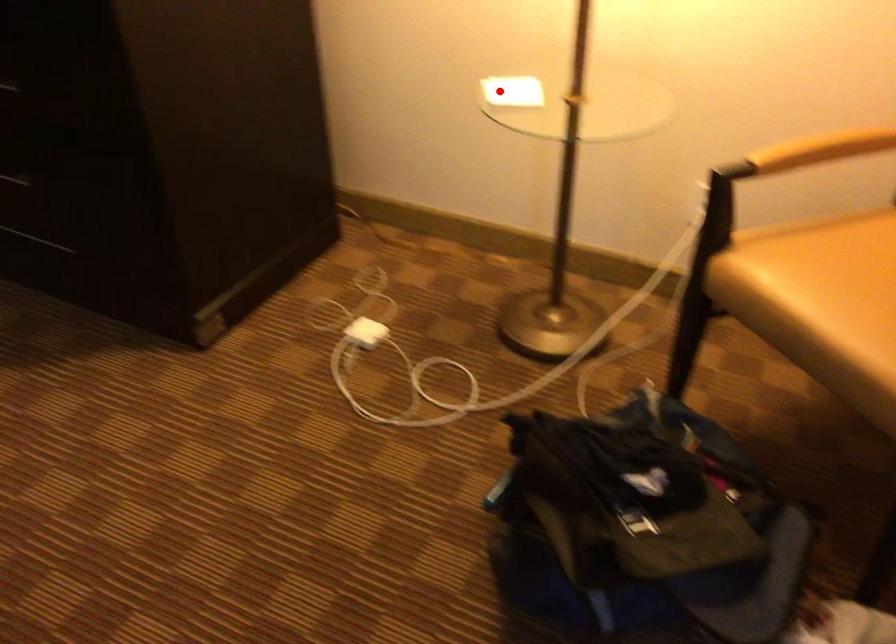
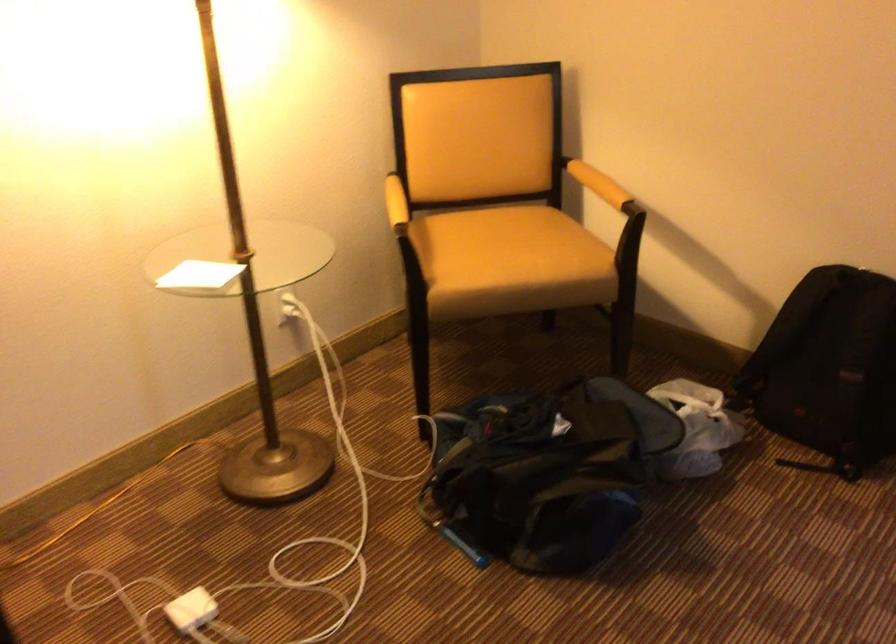
Where in the second image is the point corresponding to the highlighted location from the first image?

(199, 275)